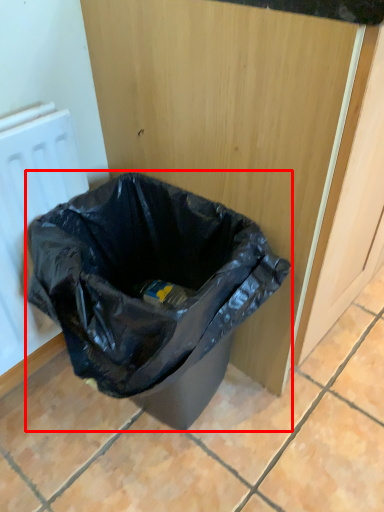
Question: Where is waste container (annotated by the red box) located in relation to radiator in the image?

Choices:
 (A) left
 (B) right

Answer: (B)